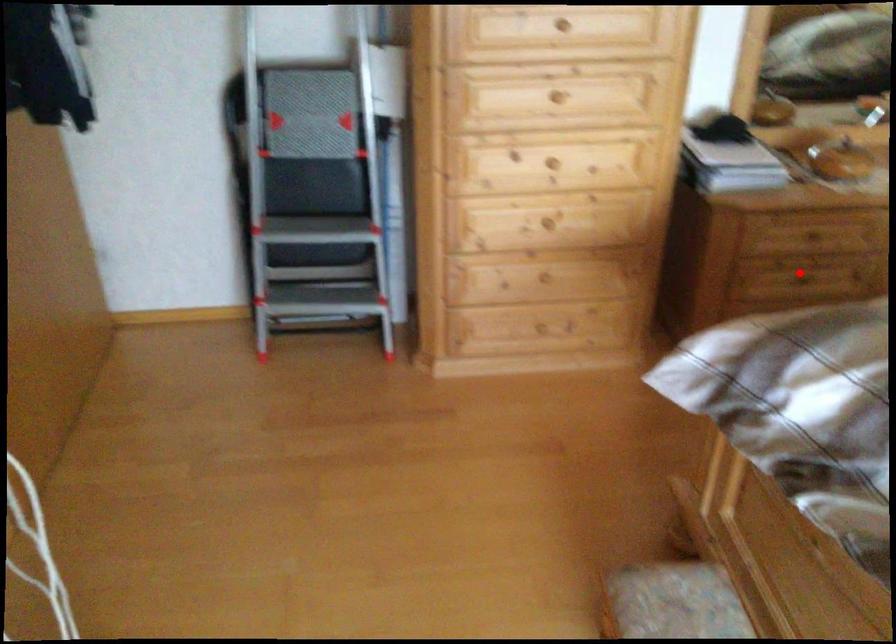
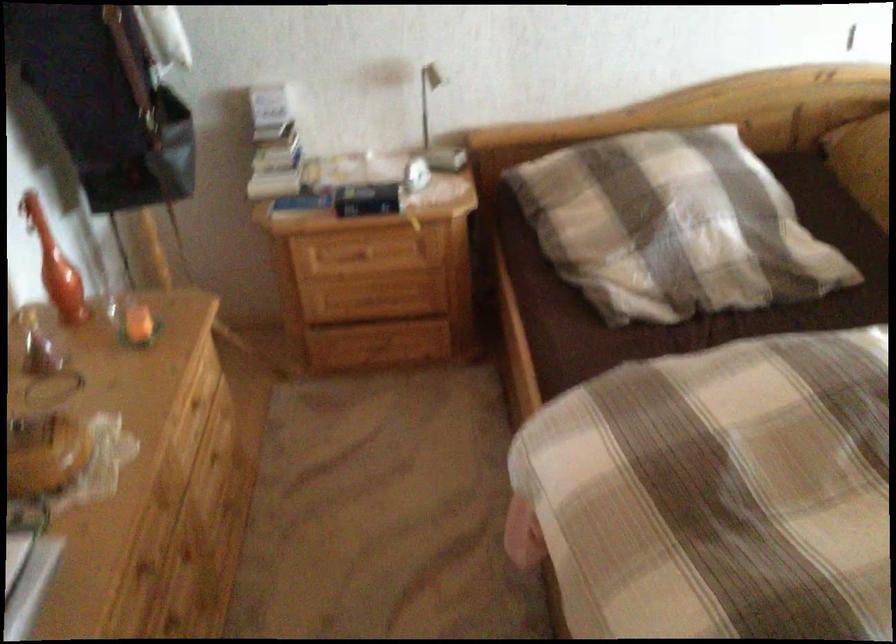
The point at the highlighted location is marked in the first image. Where is the corresponding point in the second image?

(174, 627)